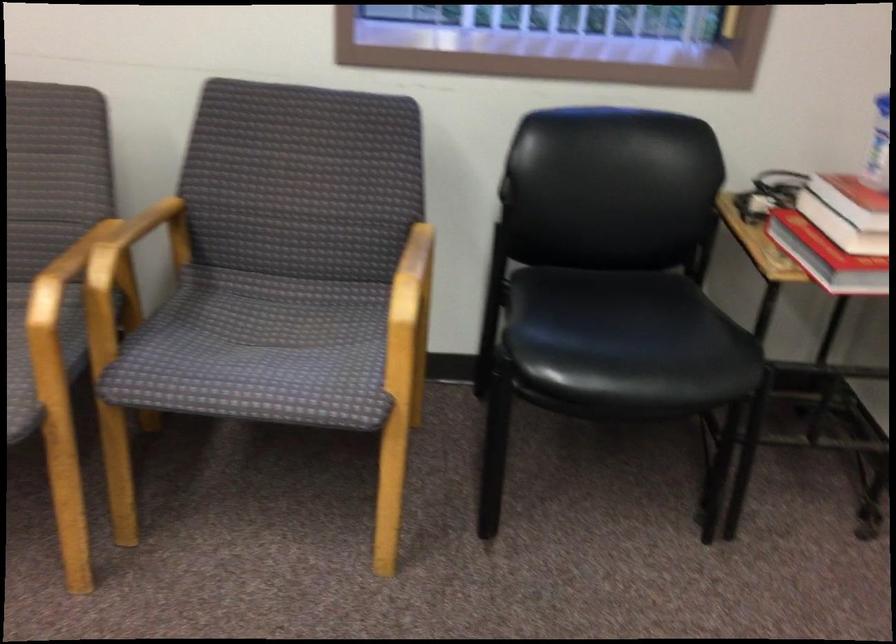
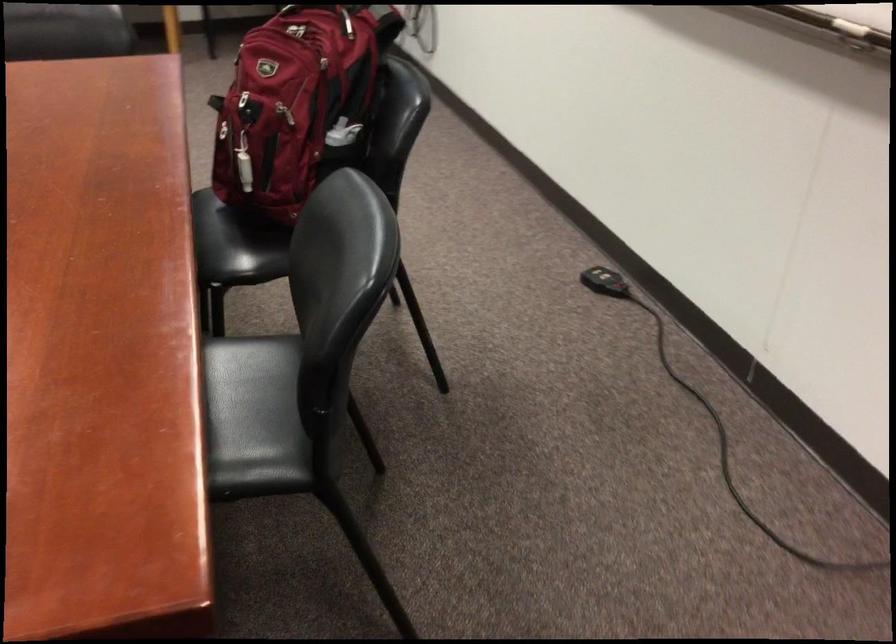
Question: The images are taken continuously from a first-person perspective. In which direction are you moving?

Choices:
 (A) Left
 (B) Right
 (C) Forward
 (D) Backward

Answer: (D)